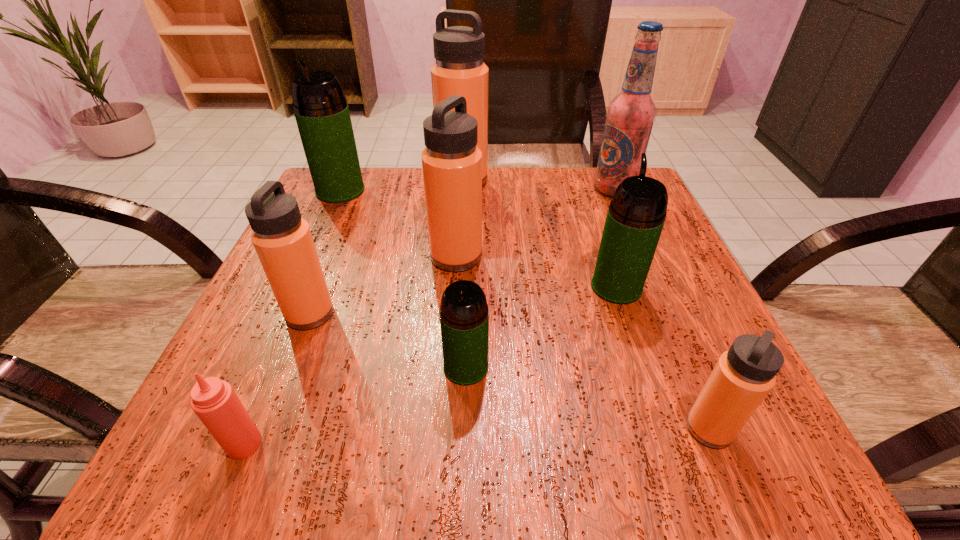
In the image, there is a desktop. Where is `vacant space at the near left corner`? vacant space at the near left corner is located at coordinates (291, 460).

In the image, there is a desktop. Where is `vacant space at the far right corner`? Image resolution: width=960 pixels, height=540 pixels. vacant space at the far right corner is located at coordinates (583, 168).

This screenshot has height=540, width=960. What are the coordinates of `unoccupied position between the alcohol and the Tabasco sauce` in the screenshot? It's located at (429, 316).

You are a GUI agent. You are given a task and a screenshot of the screen. Output one action in this format:
    pyautogui.click(x=<x>, y=<y>)
    Task: Click on the free spot between the tallest thermos bottle and the Tabasco sauce
    This screenshot has width=960, height=540.
    Given the screenshot: What is the action you would take?
    pyautogui.click(x=353, y=312)

Identify the location of vacant region between the farthest orange thermos bottle and the second nearest green thermos bottle. (540, 234).

What are the coordinates of `free spot between the alcohol and the shortest object` in the screenshot? It's located at (429, 316).

I want to click on free space between the nearest green thermos bottle and the second smallest green thermos bottle, so click(541, 327).

Locate an element on the screen. Image resolution: width=960 pixels, height=540 pixels. free point between the alcohol and the farthest orange thermos bottle is located at coordinates (539, 185).

Where is `the seventh closest object to the blue alcohol`? The image size is (960, 540). the seventh closest object to the blue alcohol is located at coordinates (282, 239).

In order to click on object that stands as the seventh closest to the biggest orange thermos bottle in this screenshot , I will do `click(743, 376)`.